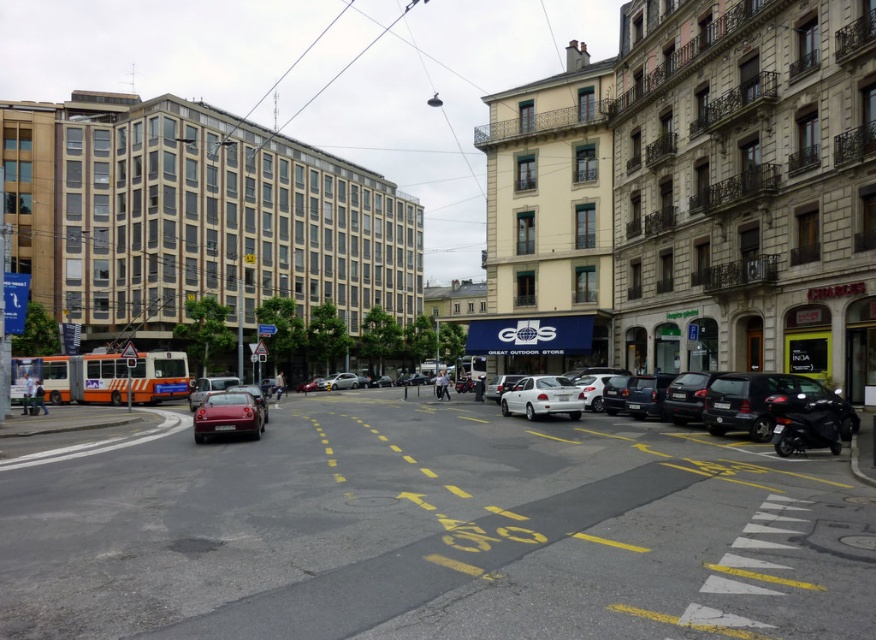
You are a pedestrian standing at the crosswalk on the left side of the street. You want to cross to the building with ornate balconies on the right. There are two cars in the road. Which car, the shiny red car at center or the white matte car at center, is closer to the crosswalk you are standing on?

The shiny red car at center is closer to the crosswalk you are standing on because it is positioned to the left of the white matte car at center, meaning it is nearer to the left side where the crosswalk is located.

You are a delivery drone flying over an urban street scene. You need to land at the point marked by the coordinates given. Is the landing surface at point (433, 531) suitable for landing? Please consider the surface type and any obstacles nearby.

The point (433, 531) is on smooth asphalt road at center, so yes, the landing surface is suitable for landing as asphalt is a stable surface and there are no obstacles mentioned nearby.